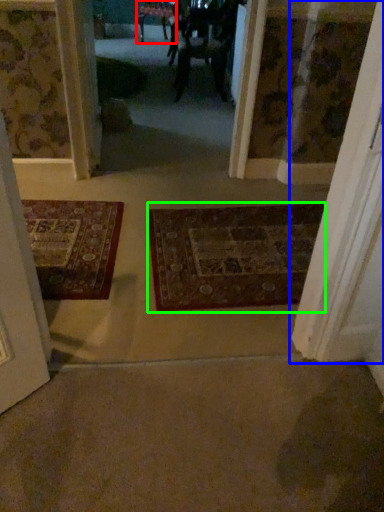
Question: Which object is the farthest from furniture (highlighted by a red box)? Choose among these: door (highlighted by a blue box) or mat (highlighted by a green box).

Choices:
 (A) door
 (B) mat

Answer: (A)